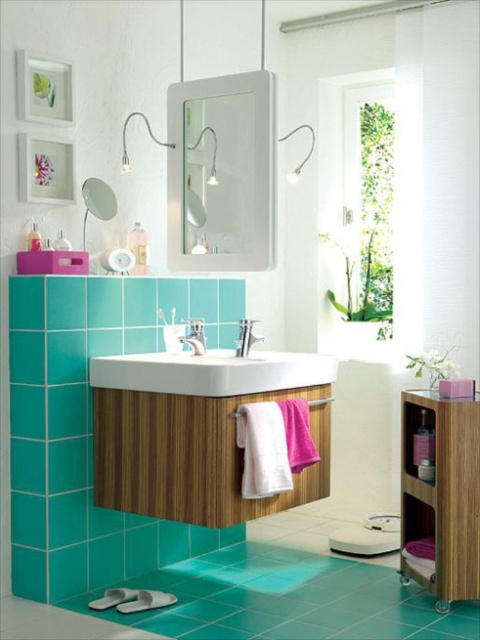
Question: Which point is farther to the camera?

Choices:
 (A) (256, 100)
 (B) (287, 374)
 (C) (188, 333)

Answer: (C)

Question: Which point is farther from the camera taking this photo?

Choices:
 (A) (440, 512)
 (B) (266, 365)
 (C) (184, 339)

Answer: (C)

Question: Does turquoise wood cabinet at center appear over white glossy mirror at upper center?

Choices:
 (A) yes
 (B) no

Answer: (B)

Question: Is white glossy mirror at upper center closer to the viewer compared to wooden cabinet at lower right?

Choices:
 (A) yes
 (B) no

Answer: (B)

Question: Which object is positioned farthest from the white glossy sink at center?

Choices:
 (A) white glossy mirror at upper center
 (B) wooden cabinet at lower right
 (C) silver metallic faucet at center

Answer: (B)

Question: Does white glossy sink at center have a lesser width compared to silver metallic faucet at center?

Choices:
 (A) no
 (B) yes

Answer: (A)